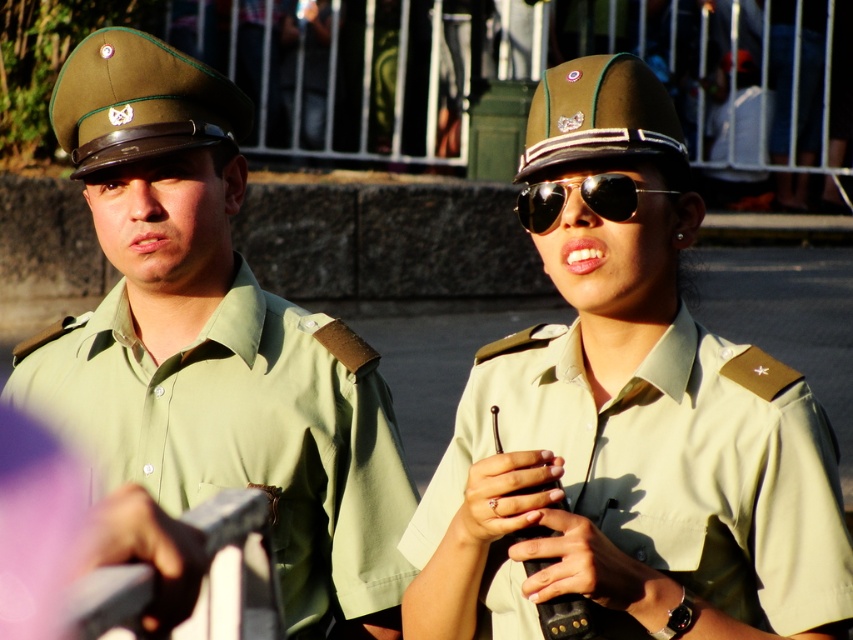
Locate an element on the screen. The height and width of the screenshot is (640, 853). green uniform shirt at left is located at coordinates [x=209, y=355].

Can you confirm if green uniform shirt at left is taller than gold reflective sunglasses at center?

Indeed, green uniform shirt at left has a greater height compared to gold reflective sunglasses at center.

Locate an element on the screen. The height and width of the screenshot is (640, 853). green uniform shirt at left is located at coordinates (209, 355).

Looking at this image, between green uniform shirt at left and khaki fabric uniform at right, which one is positioned lower?

Positioned lower is khaki fabric uniform at right.

Does green uniform shirt at left come in front of khaki fabric uniform at right?

No, green uniform shirt at left is further to the viewer.

Which is behind, point (280, 340) or point (747, 394)?

Positioned behind is point (280, 340).

The height and width of the screenshot is (640, 853). In order to click on green uniform shirt at left in this screenshot , I will do `click(209, 355)`.

Does khaki fabric uniform at right have a greater width compared to gold reflective sunglasses at center?

Yes.

Locate an element on the screen. khaki fabric uniform at right is located at coordinates (663, 468).

Find the location of a particular element. The image size is (853, 640). khaki fabric uniform at right is located at coordinates (663, 468).